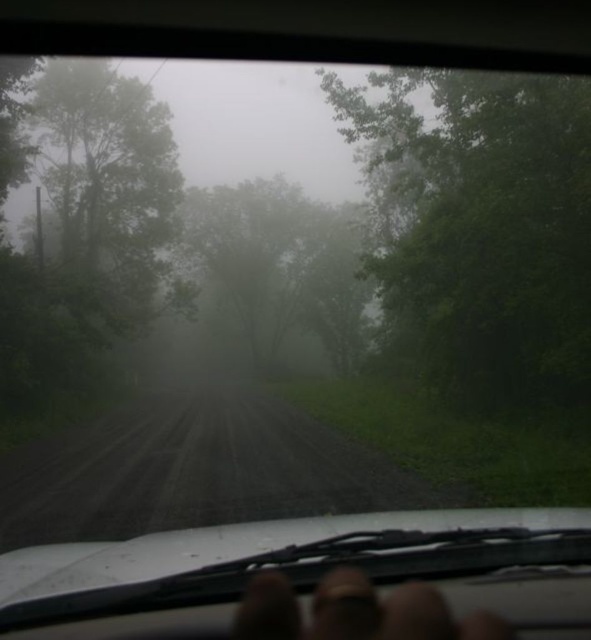
Question: Can you confirm if green leafy tree at right is positioned below green leafy tree at left?

Choices:
 (A) no
 (B) yes

Answer: (A)

Question: Considering the real-world distances, which object is farthest from the green matte tree at center?

Choices:
 (A) dull brown dirt track at center
 (B) green leafy tree at left
 (C) green leafy tree at right
 (D) finger at center

Answer: (D)

Question: Is green leafy tree at left below dull brown dirt track at center?

Choices:
 (A) yes
 (B) no

Answer: (B)

Question: Which is farther from the green leafy tree at right?

Choices:
 (A) green matte tree at center
 (B) green leafy tree at left
 (C) finger at center

Answer: (C)

Question: Which of the following is the farthest from the observer?

Choices:
 (A) green leafy tree at left
 (B) dull brown dirt track at center

Answer: (A)

Question: Is green matte tree at center thinner than finger at center?

Choices:
 (A) no
 (B) yes

Answer: (A)